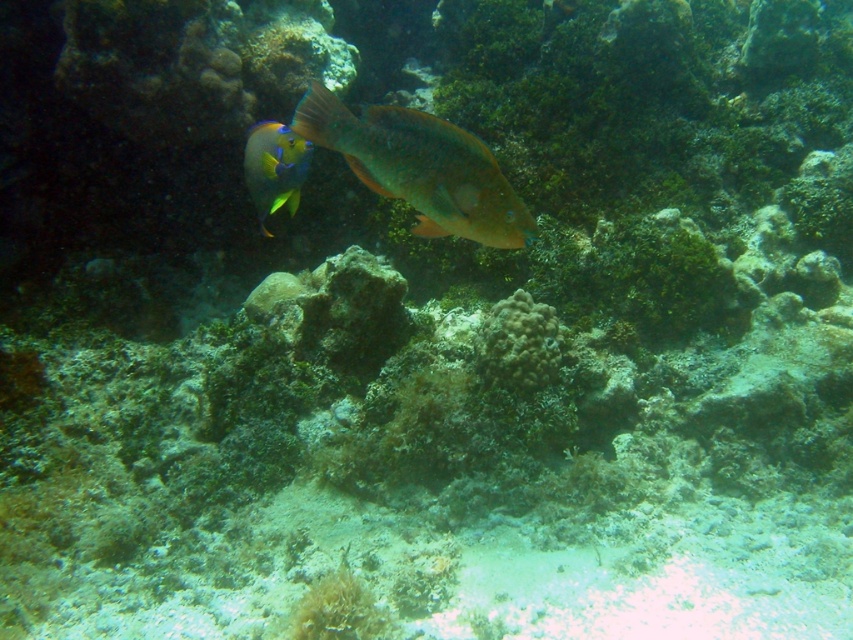
You are a marine biologist observing the underwater scene. You notice a shiny orange fish at center and a rough textured coral at center. Which object occupies more space in the image?

The shiny orange fish at center is larger in size than the rough textured coral at center, so it occupies more space in the image.

You are a marine biologist studying underwater life. You observe the shiny orange fish at center in the image. If you were to mark its position on a grid from 0 to 1 in both x and y coordinates, what would be its approximate coordinates?

The 2D location of the shiny orange fish at center is at point (421, 168), so its approximate coordinates would be around 0.26 on the x axis and 0.5 on the y axis.